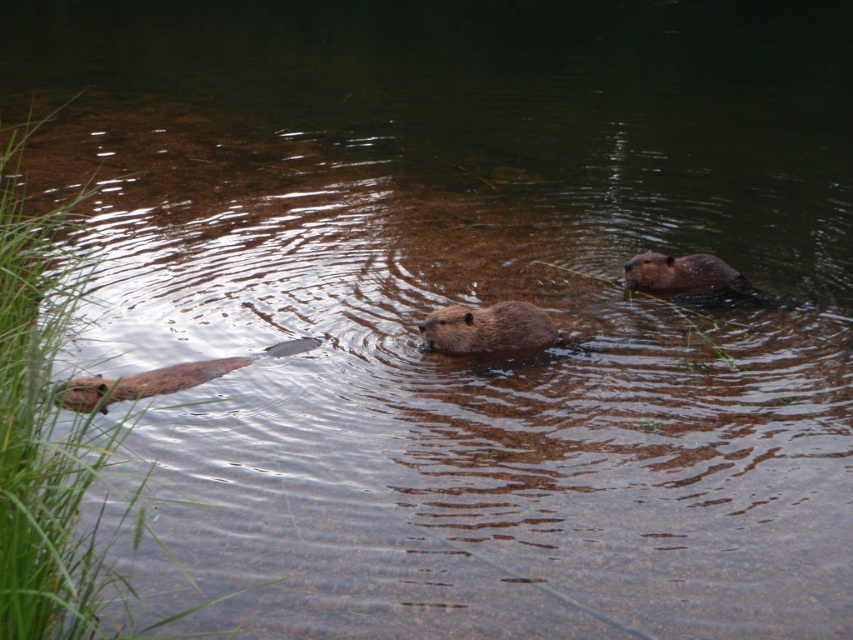
You are a wildlife photographer aiming to capture a photo of the brown furry beaver at center and the brown furry beaver at upper right. Based on their sizes in the image, which beaver would appear smaller in your photo?

The brown furry beaver at center would appear smaller in the photo because it is not as tall as the brown furry beaver at upper right.

You are a wildlife photographer trying to capture the beavers in the water. You notice two brown furry beavers in the scene. Which one is closer to the camera, the brown furry beaver at center or the brown furry beaver at upper right?

The brown furry beaver at center is smaller than the brown furry beaver at upper right, which indicates that the brown furry beaver at center is closer to the camera.

You are a wildlife photographer aiming to capture a closeup shot of the beavers. You have a camera lens that can focus on objects up to 1 meter wide. Based on the scene, will the brown furry beaver at center and the brown furry beaver at upper right both fit within the camera lens focus range?

The brown furry beaver at center has a width less than the brown furry beaver at upper right. Since the camera lens can focus on objects up to 1 meter wide, both beavers will fit within the focus range as long as their individual widths are under 1 meter. However, the exact widths are not provided, so we cannot confirm definitively. But according to the description, the center beaver is narrower than the upper right one, so if the upper right beaver is under 1 meter, both would fit.